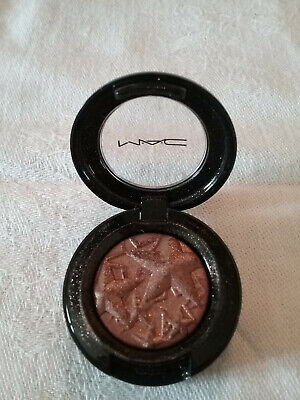
Identify the location of black makeup compact base. (169, 367).